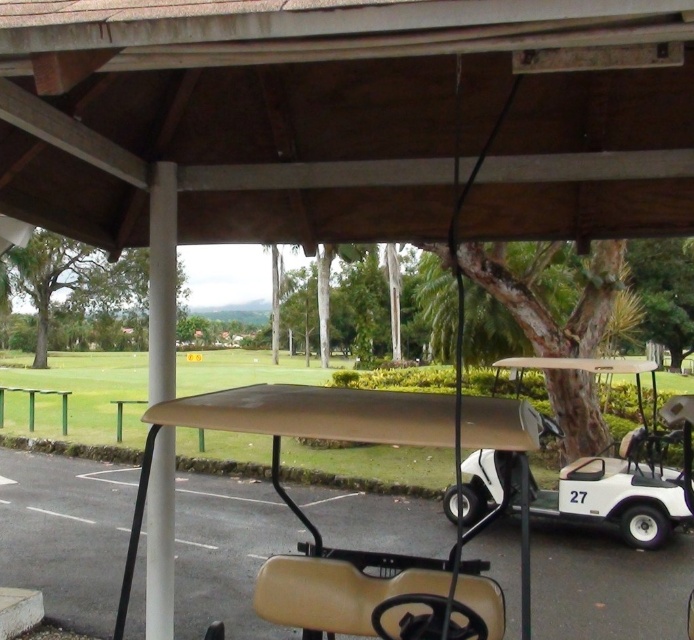
From the picture: You are standing at the entrance of the wooden structure and want to reach the beige matte golf cart at center. Which direction should you walk to find it?

The beige matte golf cart at center is located at point (362,550), so you should walk towards the center of the paved area to reach it.

You are a maintenance worker checking the height of the two golf carts. The beige matte golf cart at center and the white matte golf cart at center. Which one is taller?

The beige matte golf cart at center is taller than the white matte golf cart at center.